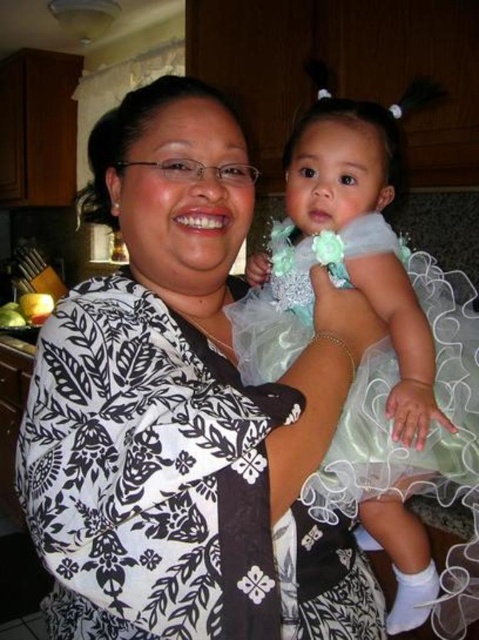
You are helping a child get dressed and see the white printed dress at center and the tulle dress at center. Which dress is on the left side?

The white printed dress at center is positioned on the left side of the tulle dress at center.

You are a fashion designer observing the image. You need to determine which dress is more accessible to adjust the hem. Which dress, the white printed dress at center or the tulle dress at center, is closer to you?

The white printed dress at center is closer to the viewer than the tulle dress at center, so the white printed dress at center is more accessible to adjust the hem.